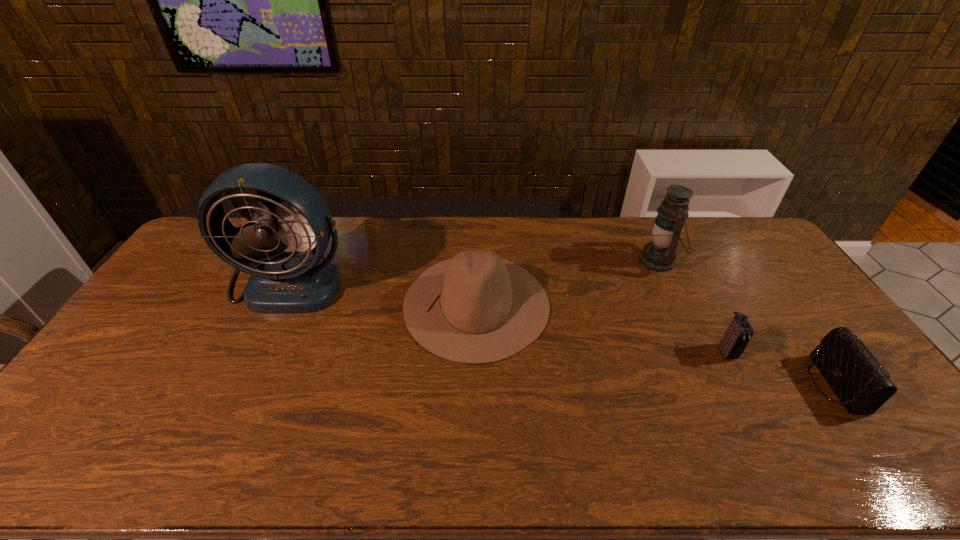
Where is `free location at the right edge`? This screenshot has height=540, width=960. free location at the right edge is located at coordinates (824, 399).

Locate an element on the screen. Image resolution: width=960 pixels, height=540 pixels. free spot between the second object from left to right and the right clutch bag is located at coordinates (655, 344).

Locate an element on the screen. free space between the tallest object and the sombrero is located at coordinates (384, 292).

At what (x,y) coordinates should I click in order to perform the action: click on empty space between the leftmost object and the third tallest object. Please return your answer as a coordinate pair (x, y). The height and width of the screenshot is (540, 960). Looking at the image, I should click on (384, 292).

Find the location of a particular element. free space between the left clutch bag and the right clutch bag is located at coordinates (780, 368).

Where is `free space that is in between the fourth object from right to left and the leftmost object`? This screenshot has width=960, height=540. free space that is in between the fourth object from right to left and the leftmost object is located at coordinates [384, 292].

Find the location of `blank region between the tallest object and the sombrero`. blank region between the tallest object and the sombrero is located at coordinates (384, 292).

Where is `vacant area that lies between the second object from left to right and the left clutch bag`? The width and height of the screenshot is (960, 540). vacant area that lies between the second object from left to right and the left clutch bag is located at coordinates (601, 328).

Point out which object is positioned as the nearest to the third shortest object. Please provide its 2D coordinates. Your answer should be formatted as a tuple, i.e. [(x, y)], where the tuple contains the x and y coordinates of a point satisfying the conditions above.

[(288, 211)]

Find the location of a particular element. Image resolution: width=960 pixels, height=540 pixels. object that can be found as the fourth closest to the third shortest object is located at coordinates (861, 385).